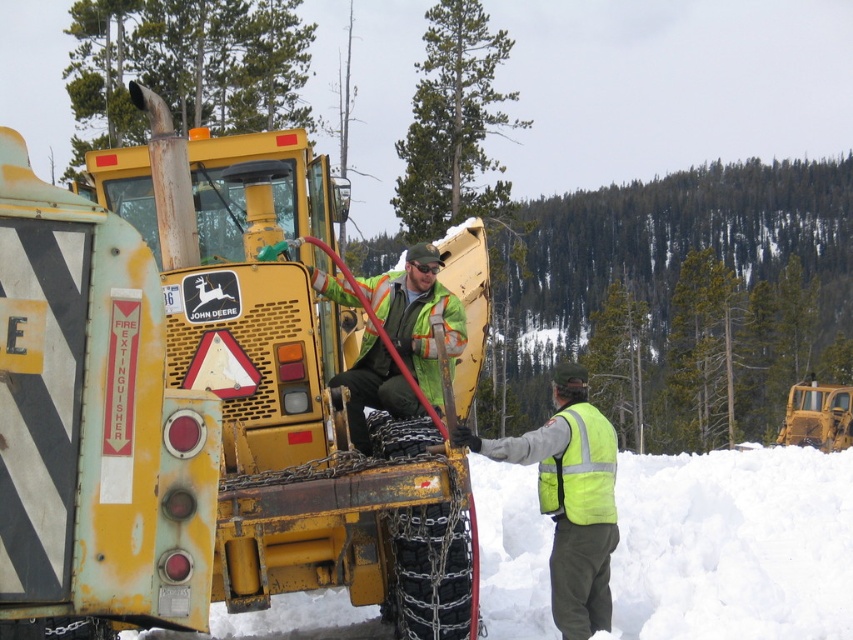
Question: Which of the following is the closest to the observer?

Choices:
 (A) (84, 342)
 (B) (637, 541)

Answer: (A)

Question: Does yellow matte tractor at center have a smaller size compared to yellow reflective vest at right?

Choices:
 (A) no
 (B) yes

Answer: (A)

Question: Is yellow matte tractor at center further to the viewer compared to yellow rubber tractor at right?

Choices:
 (A) no
 (B) yes

Answer: (A)

Question: Which of the following is the farthest from the observer?

Choices:
 (A) (612, 508)
 (B) (809, 550)
 (C) (94, 243)

Answer: (B)

Question: Is yellow reflective vest at right to the left of yellow rubber tractor at right from the viewer's perspective?

Choices:
 (A) yes
 (B) no

Answer: (A)

Question: Which of the following is the closest to the observer?

Choices:
 (A) (252, 428)
 (B) (566, 497)
 (C) (341, 589)
 (D) (836, 426)

Answer: (A)